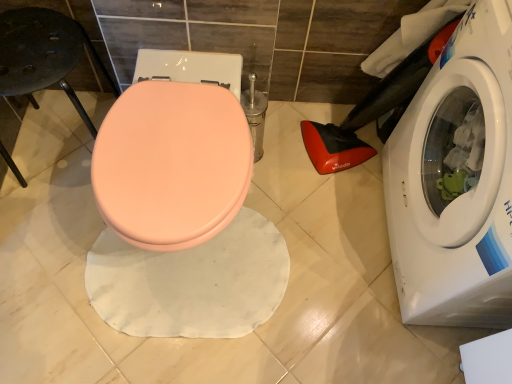
Find the location of a particular element. The image size is (512, 384). black matte bar stool at left is located at coordinates (42, 54).

The image size is (512, 384). I want to click on matte peach toilet seat at center, so click(x=174, y=152).

From a real-world perspective, between matte peach toilet seat at center and black matte bar stool at left, who is vertically lower?

black matte bar stool at left, from a real-world perspective.

From the image's perspective, is matte peach toilet seat at center located beneath black matte bar stool at left?

Yes, from the image's perspective, matte peach toilet seat at center is beneath black matte bar stool at left.

Which of these two, matte peach toilet seat at center or black matte bar stool at left, is bigger?

Bigger between the two is matte peach toilet seat at center.

Is point (246, 143) closer to camera compared to point (92, 46)?

Yes, point (246, 143) is closer to viewer.

Which is farther from the camera, [397,281] or [224,159]?

Positioned behind is point [397,281].

Does white glossy washing machine at lower right come in front of matte peach toilet seat at center?

Yes, it is in front of matte peach toilet seat at center.

In the image, is white glossy washing machine at lower right on the left side or the right side of matte peach toilet seat at center?

From the image, it's evident that white glossy washing machine at lower right is to the right of matte peach toilet seat at center.

Which of these two, white glossy washing machine at lower right or matte peach toilet seat at center, is wider?

With larger width is matte peach toilet seat at center.

Image resolution: width=512 pixels, height=384 pixels. In order to click on toilet lying on the right of black matte bar stool at left in this screenshot , I will do tap(174, 152).

Which is behind, point (19, 65) or point (228, 67)?

Positioned behind is point (228, 67).

Based on the photo, is black matte bar stool at left located outside matte peach toilet seat at center?

Yes, black matte bar stool at left is outside of matte peach toilet seat at center.

In the scene shown: Between black matte bar stool at left and white glossy washing machine at lower right, which one has smaller size?

black matte bar stool at left is smaller.

From the image's perspective, is black matte bar stool at left on top of white glossy washing machine at lower right?

Yes.

Is black matte bar stool at left wider than white glossy washing machine at lower right?

Incorrect, the width of black matte bar stool at left does not surpass that of white glossy washing machine at lower right.

Does matte peach toilet seat at center appear on the left side of white glossy washing machine at lower right?

Yes.

Is matte peach toilet seat at center taller or shorter than white glossy washing machine at lower right?

Clearly, matte peach toilet seat at center is shorter compared to white glossy washing machine at lower right.

Does matte peach toilet seat at center have a greater width compared to white glossy washing machine at lower right?

Correct, the width of matte peach toilet seat at center exceeds that of white glossy washing machine at lower right.

Which is nearer, (493, 71) or (8, 15)?

Point (493, 71).

Is white glossy washing machine at lower right positioned with its back to black matte bar stool at left?

white glossy washing machine at lower right is not turned away from black matte bar stool at left.

How far apart are white glossy washing machine at lower right and black matte bar stool at left?

white glossy washing machine at lower right and black matte bar stool at left are 3.39 feet apart from each other.

Considering the positions of objects white glossy washing machine at lower right and black matte bar stool at left in the image provided, who is behind, white glossy washing machine at lower right or black matte bar stool at left?

black matte bar stool at left is more distant.

Where is `toilet in front of the black matte bar stool at left`? toilet in front of the black matte bar stool at left is located at coordinates (174, 152).

Identify the location of toilet behind the white glossy washing machine at lower right. (174, 152).

From the image, which object appears to be farther from white glossy washing machine at lower right, matte peach toilet seat at center or black matte bar stool at left?

black matte bar stool at left is further to white glossy washing machine at lower right.

When comparing their distances from white glossy washing machine at lower right, does black matte bar stool at left or matte peach toilet seat at center seem closer?

Based on the image, matte peach toilet seat at center appears to be nearer to white glossy washing machine at lower right.

Which object lies further to the anchor point matte peach toilet seat at center, black matte bar stool at left or white glossy washing machine at lower right?

Among the two, white glossy washing machine at lower right is located further to matte peach toilet seat at center.

Looking at the image, which one is located closer to matte peach toilet seat at center, white glossy washing machine at lower right or black matte bar stool at left?

black matte bar stool at left is closer to matte peach toilet seat at center.

Based on the photo, looking at the image, which one is located further to black matte bar stool at left, white glossy washing machine at lower right or matte peach toilet seat at center?

The object further to black matte bar stool at left is white glossy washing machine at lower right.

Looking at the image, which one is located further to black matte bar stool at left, matte peach toilet seat at center or white glossy washing machine at lower right?

The object further to black matte bar stool at left is white glossy washing machine at lower right.

What are the coordinates of `toilet between black matte bar stool at left and white glossy washing machine at lower right from left to right` in the screenshot? It's located at (174, 152).